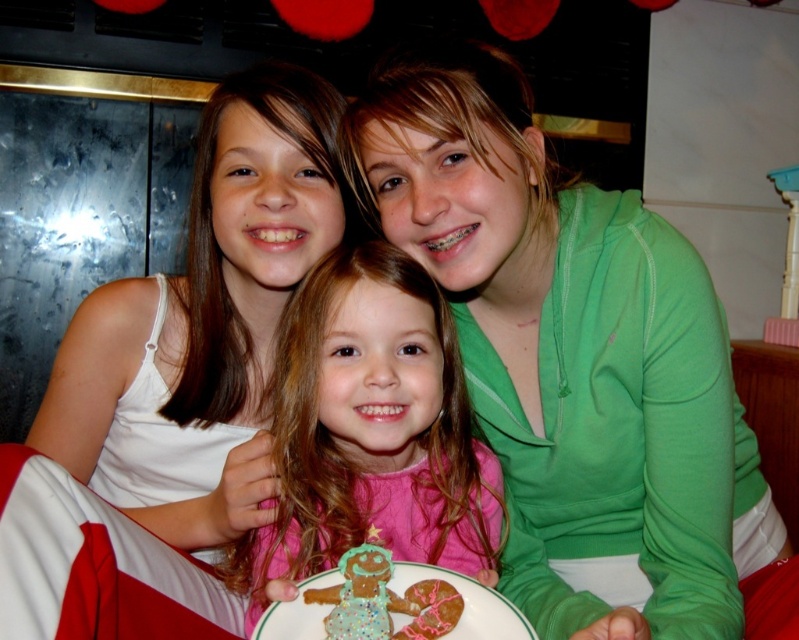
Question: Which point is farther to the camera?

Choices:
 (A) (511, 589)
 (B) (358, 292)
 (C) (244, 72)

Answer: (C)

Question: Which point is closer to the camera taking this photo?

Choices:
 (A) (199, 540)
 (B) (348, 355)

Answer: (B)

Question: Does pink matte dress at center appear over glazed sugar cookie at center?

Choices:
 (A) yes
 (B) no

Answer: (A)

Question: Estimate the real-world distances between objects in this image. Which object is farther from the pink matte dress at center?

Choices:
 (A) green soft hoodie at center
 (B) green matte sweater at upper right
 (C) glazed sugar cookie at center

Answer: (C)

Question: Does green matte sweater at upper right have a smaller size compared to glazed sugar cookie at center?

Choices:
 (A) yes
 (B) no

Answer: (B)

Question: Is green matte sweater at upper right to the right of glazed sugar cookie at center from the viewer's perspective?

Choices:
 (A) yes
 (B) no

Answer: (B)